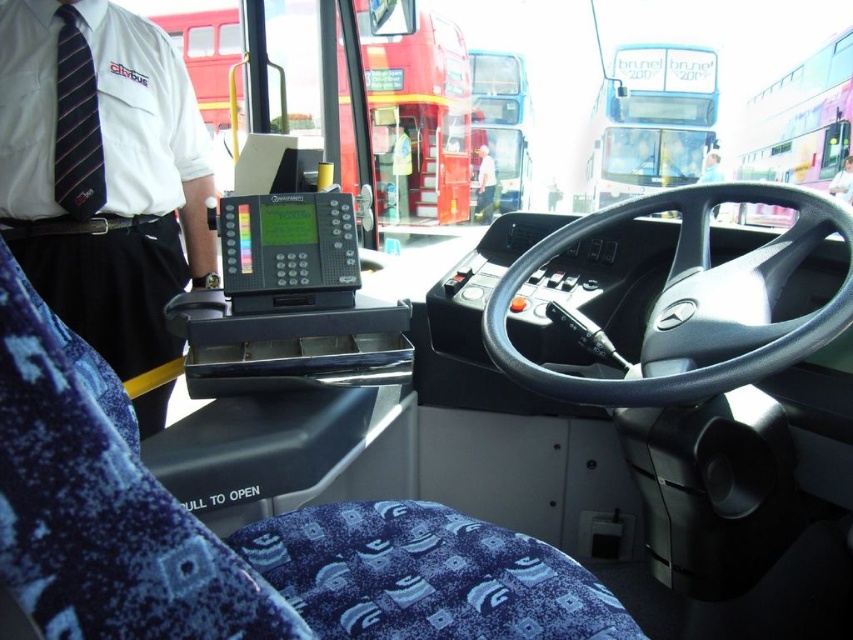
Can you confirm if white shirt with tie at upper left is positioned to the left of white fabric shirt at center?

Yes, white shirt with tie at upper left is to the left of white fabric shirt at center.

I want to click on white shirt with tie at upper left, so click(x=102, y=172).

At what (x,y) coordinates should I click in order to perform the action: click on white shirt with tie at upper left. Please return your answer as a coordinate pair (x, y). Looking at the image, I should click on (102, 172).

Is point (479, 205) behind point (57, 170)?

That is True.

Is point (496, 134) positioned in front of point (57, 196)?

No, (496, 134) is behind (57, 196).

Find the location of a particular element. This screenshot has height=640, width=853. metallic silver bus at center is located at coordinates (498, 131).

Is white shirt with tie at upper left to the right of black plastic electronic device at center from the viewer's perspective?

Indeed, white shirt with tie at upper left is positioned on the right side of black plastic electronic device at center.

Does white shirt with tie at upper left come behind black plastic electronic device at center?

No, it is not.

The image size is (853, 640). What are the coordinates of `white shirt with tie at upper left` in the screenshot? It's located at (102, 172).